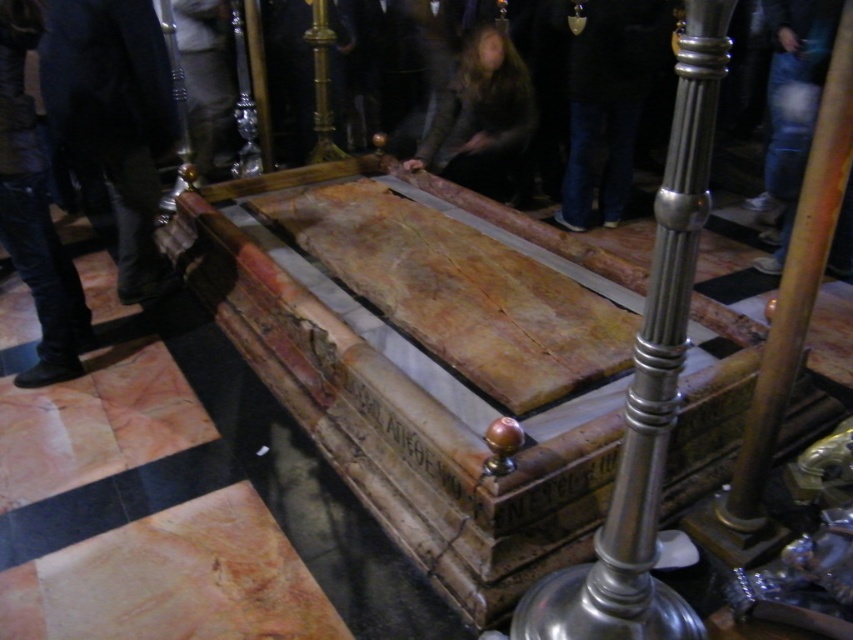
You are an archaeologist examining the sarcophagus and notice two items nearby. You see the dark blue jeans at lower left and the dark brown leather jacket at center. Which item is taller?

The dark blue jeans at lower left is much taller than the dark brown leather jacket at center.

You are standing in front of the wooden sarcophagus with railings around it. You notice two items nearby. Which one is bigger between the dark blue jeans at lower left and the dark brown leather jacket at center?

The dark blue jeans at lower left has a larger size compared to the dark brown leather jacket at center, so the dark blue jeans at lower left is bigger.